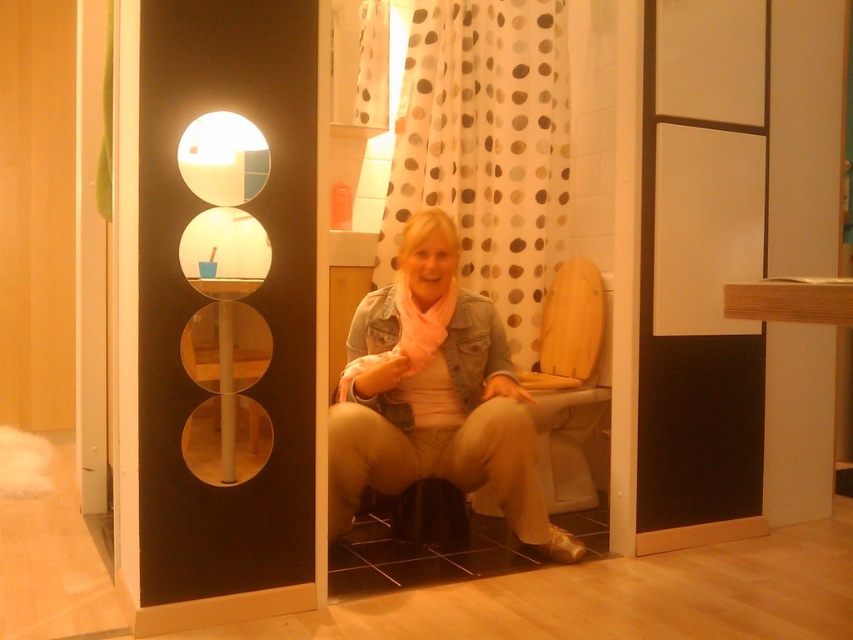
Between white polka dot fabric at upper center and wooden at center, which one has more height?

Standing taller between the two is white polka dot fabric at upper center.

Does white polka dot fabric at upper center appear on the left side of wooden at center?

Yes, white polka dot fabric at upper center is to the left of wooden at center.

Which is behind, point (422, 125) or point (541, 314)?

The point (541, 314) is more distant.

Where is `white polka dot fabric at upper center`? The height and width of the screenshot is (640, 853). white polka dot fabric at upper center is located at coordinates (485, 147).

Identify the location of white polka dot fabric at upper center. (485, 147).

Can you confirm if white polka dot fabric at upper center is bigger than denim jacket at center?

Yes.

Is point (428, 26) positioned behind point (410, 288)?

Yes, it is behind point (410, 288).

Find the location of `white polka dot fabric at upper center`. white polka dot fabric at upper center is located at coordinates (485, 147).

Is denim jacket at center below wooden at center?

Correct, denim jacket at center is located below wooden at center.

What do you see at coordinates (434, 396) in the screenshot? I see `denim jacket at center` at bounding box center [434, 396].

Who is more forward, (485, 435) or (572, 352)?

Point (485, 435) is in front.

The width and height of the screenshot is (853, 640). In order to click on denim jacket at center in this screenshot , I will do `click(434, 396)`.